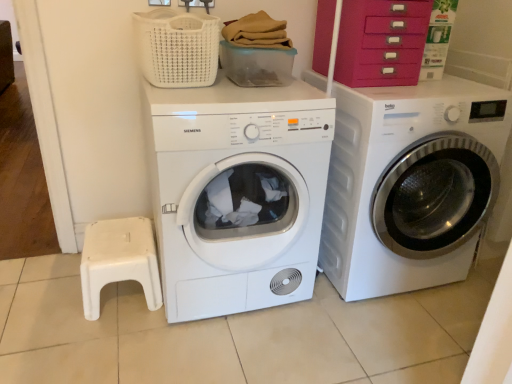
Locate an element on the screen. vacant area that lies between white glossy washing machine at right, placed as the 2th washing machine when sorted from left to right, and white matte dryer at center, positioned as the second washing machine in right-to-left order is located at coordinates (287, 323).